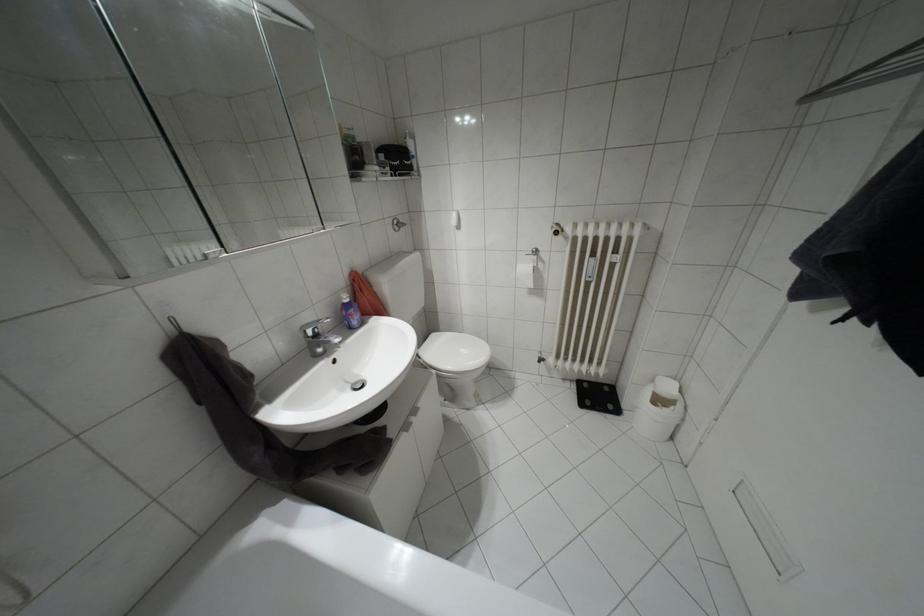
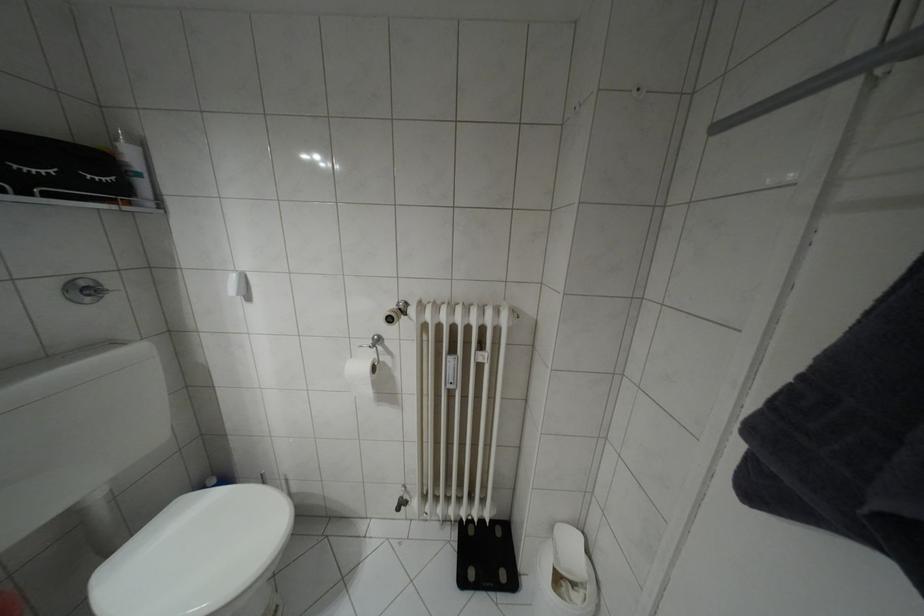
Find the pixel in the second image that matches (x=530, y=284) in the first image.

(369, 392)